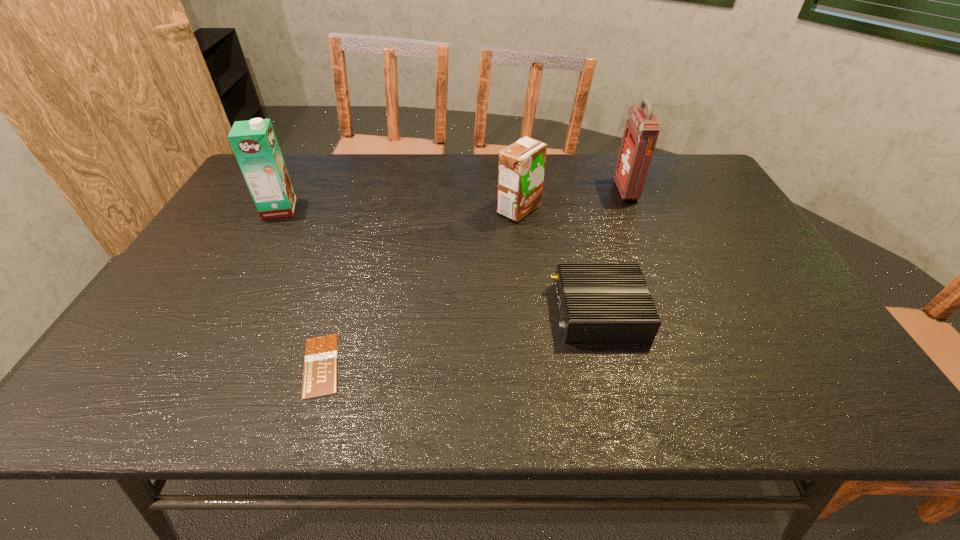
The height and width of the screenshot is (540, 960). What are the coordinates of `vacant region located 0.330m on the front-facing side of the first-aid kit` in the screenshot? It's located at (514, 191).

Where is `vacant space located 0.350m on the right of the left carton`? vacant space located 0.350m on the right of the left carton is located at coordinates (414, 209).

Identify the location of free space located 0.290m on the straw side of the shorter carton. The height and width of the screenshot is (540, 960). (399, 210).

Where is `vacant space located on the straw side of the shorter carton`? vacant space located on the straw side of the shorter carton is located at coordinates (456, 210).

At what (x,y) coordinates should I click in order to perform the action: click on vacant point located on the straw side of the shorter carton. Please return your answer as a coordinate pair (x, y). Looking at the image, I should click on (413, 210).

This screenshot has height=540, width=960. In order to click on free space located 0.180m on the back panel of the fourth tallest object in this screenshot , I will do `click(475, 311)`.

Find the location of a particular element. The width and height of the screenshot is (960, 540). vacant space located 0.330m on the back panel of the fourth tallest object is located at coordinates (411, 311).

Locate an element on the screen. This screenshot has height=540, width=960. vacant space situated 0.150m on the back panel of the fourth tallest object is located at coordinates (489, 311).

The width and height of the screenshot is (960, 540). I want to click on vacant space located 0.060m on the back of the chocolate bar, so click(337, 314).

Image resolution: width=960 pixels, height=540 pixels. Find the location of `object that is positioned at the far edge`. object that is positioned at the far edge is located at coordinates (642, 128).